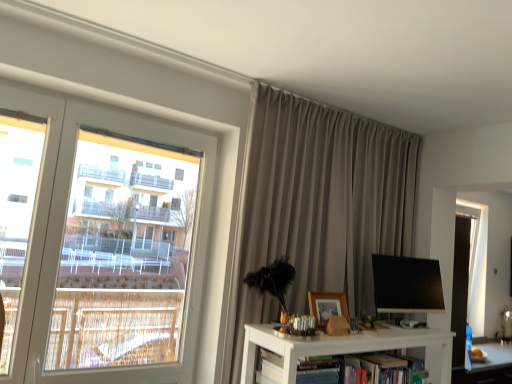
Question: Does matte gray curtain at upper center contain hardcover book at center?

Choices:
 (A) yes
 (B) no

Answer: (B)

Question: Can you confirm if matte gray curtain at upper center is positioned to the right of hardcover book at center?

Choices:
 (A) no
 (B) yes

Answer: (A)

Question: Considering the relative positions of matte gray curtain at upper center and hardcover book at center in the image provided, is matte gray curtain at upper center to the left of hardcover book at center from the viewer's perspective?

Choices:
 (A) no
 (B) yes

Answer: (B)

Question: From a real-world perspective, is matte gray curtain at upper center physically below hardcover book at center?

Choices:
 (A) no
 (B) yes

Answer: (A)

Question: From the image's perspective, is matte gray curtain at upper center under hardcover book at center?

Choices:
 (A) no
 (B) yes

Answer: (A)

Question: Is matte gray curtain at upper center turned away from hardcover book at center?

Choices:
 (A) no
 (B) yes

Answer: (A)

Question: Considering the relative sizes of matte gray curtain at upper center and wooden picture frame at center in the image provided, is matte gray curtain at upper center thinner than wooden picture frame at center?

Choices:
 (A) no
 (B) yes

Answer: (A)

Question: From the image's perspective, does matte gray curtain at upper center appear lower than wooden picture frame at center?

Choices:
 (A) yes
 (B) no

Answer: (B)

Question: Considering the relative positions of matte gray curtain at upper center and wooden picture frame at center in the image provided, is matte gray curtain at upper center in front of wooden picture frame at center?

Choices:
 (A) no
 (B) yes

Answer: (B)

Question: Is matte gray curtain at upper center turned away from wooden picture frame at center?

Choices:
 (A) yes
 (B) no

Answer: (A)

Question: Does matte gray curtain at upper center have a larger size compared to wooden picture frame at center?

Choices:
 (A) no
 (B) yes

Answer: (B)

Question: Can you confirm if matte gray curtain at upper center is taller than wooden picture frame at center?

Choices:
 (A) no
 (B) yes

Answer: (B)

Question: Considering the relative sizes of matte gray curtain at upper center and black glossy monitor at center in the image provided, is matte gray curtain at upper center smaller than black glossy monitor at center?

Choices:
 (A) yes
 (B) no

Answer: (B)